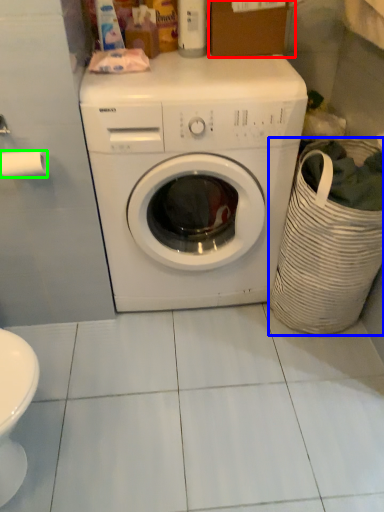
Question: Which object is the farthest from cardboard box (highlighted by a red box)? Choose among these: laundry basket (highlighted by a blue box) or toilet paper (highlighted by a green box).

Choices:
 (A) laundry basket
 (B) toilet paper

Answer: (B)